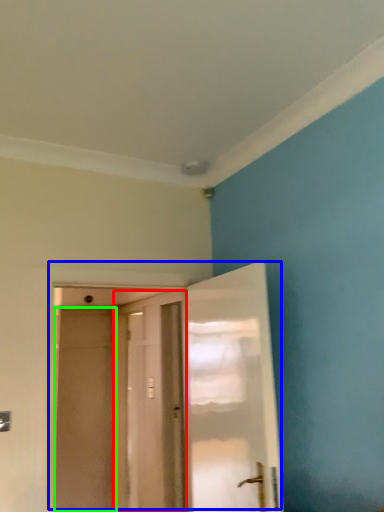
Question: Which is nearer to the door (highlighted by a red box)? door (highlighted by a blue box) or screen door (highlighted by a green box).

Choices:
 (A) door
 (B) screen door

Answer: (B)